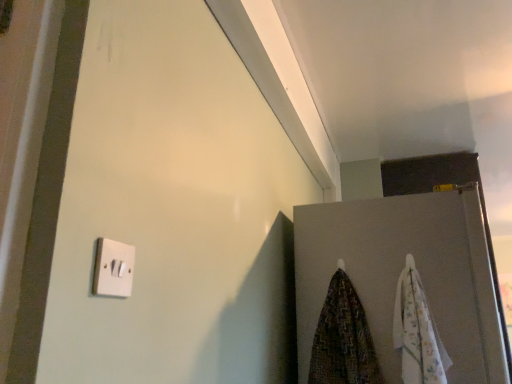
Question: From the image's perspective, is floral cotton beach towel at right, which is the 1th beach towel from right to left, beneath patterned fabric beach towel at lower right, the 1th beach towel in the left-to-right sequence?

Choices:
 (A) no
 (B) yes

Answer: (A)

Question: Is floral cotton beach towel at right, which appears as the second beach towel when viewed from the left, in contact with patterned fabric beach towel at lower right, the 1th beach towel in the left-to-right sequence?

Choices:
 (A) yes
 (B) no

Answer: (B)

Question: From the image's perspective, is floral cotton beach towel at right, which appears as the second beach towel when viewed from the left, above patterned fabric beach towel at lower right, the 1th beach towel in the left-to-right sequence?

Choices:
 (A) yes
 (B) no

Answer: (A)

Question: Is floral cotton beach towel at right, which is the 1th beach towel from right to left, oriented towards patterned fabric beach towel at lower right, the 1th beach towel in the left-to-right sequence?

Choices:
 (A) no
 (B) yes

Answer: (A)

Question: Considering the relative sizes of floral cotton beach towel at right, which appears as the second beach towel when viewed from the left, and patterned fabric beach towel at lower right, the 1th beach towel in the left-to-right sequence, in the image provided, is floral cotton beach towel at right, which appears as the second beach towel when viewed from the left, wider than patterned fabric beach towel at lower right, the 1th beach towel in the left-to-right sequence,?

Choices:
 (A) no
 (B) yes

Answer: (A)

Question: Considering the positions of floral cotton beach towel at right, which is the 1th beach towel from right to left, and white plastic light switch at lower left in the image, is floral cotton beach towel at right, which is the 1th beach towel from right to left, bigger or smaller than white plastic light switch at lower left?

Choices:
 (A) big
 (B) small

Answer: (A)

Question: Considering the positions of floral cotton beach towel at right, which appears as the second beach towel when viewed from the left, and white plastic light switch at lower left in the image, is floral cotton beach towel at right, which appears as the second beach towel when viewed from the left, taller or shorter than white plastic light switch at lower left?

Choices:
 (A) short
 (B) tall

Answer: (B)

Question: Would you say floral cotton beach towel at right, which appears as the second beach towel when viewed from the left, is inside or outside white plastic light switch at lower left?

Choices:
 (A) inside
 (B) outside

Answer: (B)

Question: From a real-world perspective, is floral cotton beach towel at right, which appears as the second beach towel when viewed from the left, positioned above or below white plastic light switch at lower left?

Choices:
 (A) above
 (B) below

Answer: (B)

Question: In the image, is white matte door at upper right on the left side or the right side of patterned fabric beach towel at lower right, the 1th beach towel in the left-to-right sequence?

Choices:
 (A) right
 (B) left

Answer: (A)

Question: Considering the positions of white matte door at upper right and patterned fabric beach towel at lower right, the 1th beach towel in the left-to-right sequence, in the image, is white matte door at upper right bigger or smaller than patterned fabric beach towel at lower right, the 1th beach towel in the left-to-right sequence,?

Choices:
 (A) small
 (B) big

Answer: (B)

Question: Is point (307, 292) positioned closer to the camera than point (337, 269)?

Choices:
 (A) farther
 (B) closer

Answer: (A)

Question: Considering their positions, is white matte door at upper right located in front of or behind patterned fabric beach towel at lower right, the 1th beach towel in the left-to-right sequence?

Choices:
 (A) behind
 (B) front

Answer: (B)

Question: Considering their positions, is white matte door at upper right located in front of or behind floral cotton beach towel at right, which is the 1th beach towel from right to left?

Choices:
 (A) behind
 (B) front

Answer: (A)

Question: Looking at their shapes, would you say white matte door at upper right is wider or thinner than floral cotton beach towel at right, which is the 1th beach towel from right to left?

Choices:
 (A) wide
 (B) thin

Answer: (A)